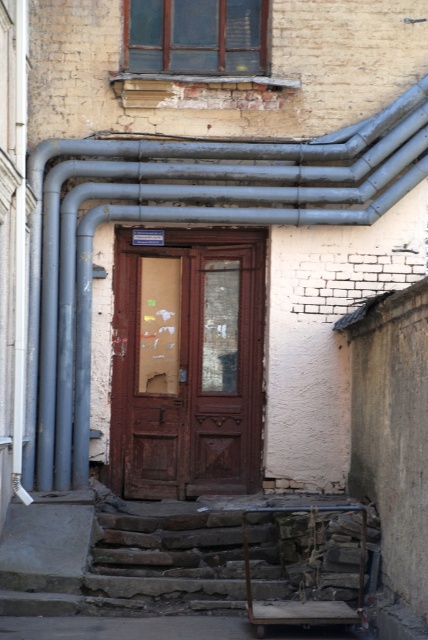
Question: Among these points, which one is farthest from the camera?

Choices:
 (A) (154, 355)
 (B) (56, 257)

Answer: (A)

Question: Is metallic gray pipes at upper left to the left of brown wooden door at center from the viewer's perspective?

Choices:
 (A) no
 (B) yes

Answer: (B)

Question: Does metallic gray pipes at upper left have a greater width compared to brown wooden door at center?

Choices:
 (A) yes
 (B) no

Answer: (A)

Question: Which of the following is the farthest from the observer?

Choices:
 (A) (216, 349)
 (B) (330, 193)

Answer: (A)

Question: Which object appears closest to the camera in this image?

Choices:
 (A) brown wooden door at center
 (B) metallic gray pipes at upper left

Answer: (B)

Question: Is metallic gray pipes at upper left further to the viewer compared to brown wooden door at center?

Choices:
 (A) yes
 (B) no

Answer: (B)